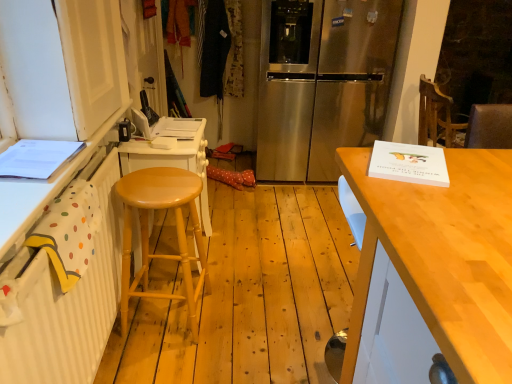
This screenshot has height=384, width=512. In order to click on vacant space to the right of light wood stool at left in this screenshot , I will do `click(240, 320)`.